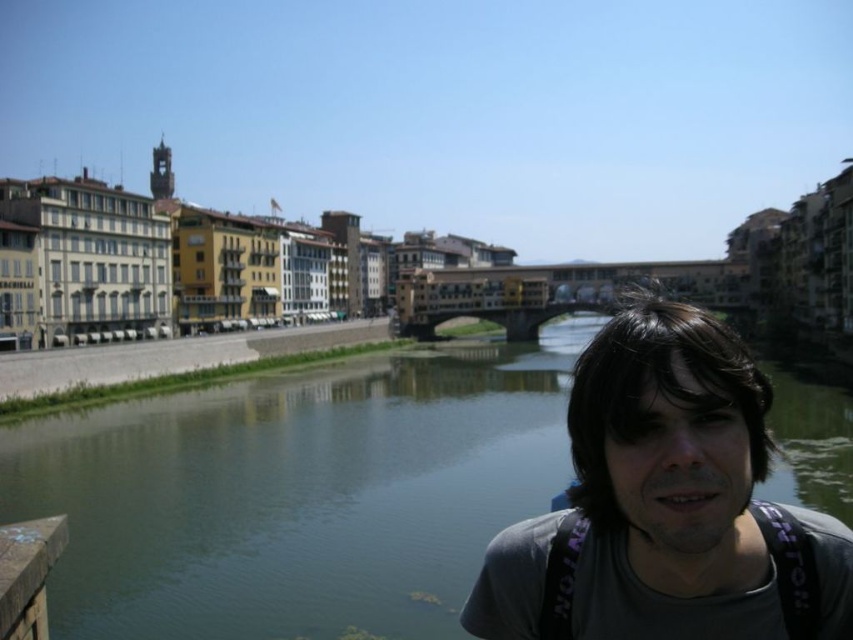
Question: Which point is farther to the camera?

Choices:
 (A) green water at center
 (B) gray fabric shirt at center
 (C) brown wooden rail at lower left

Answer: (A)

Question: Is green water at center thinner than brown wooden rail at lower left?

Choices:
 (A) yes
 (B) no

Answer: (B)

Question: Which object is positioned farthest from the green water at center?

Choices:
 (A) gray fabric shirt at center
 (B) brown wooden rail at lower left

Answer: (A)

Question: Which of the following is the closest to the observer?

Choices:
 (A) green water at center
 (B) brown wooden rail at lower left
 (C) gray fabric shirt at center

Answer: (C)

Question: Considering the relative positions of green water at center and brown wooden rail at lower left in the image provided, where is green water at center located with respect to brown wooden rail at lower left?

Choices:
 (A) left
 (B) right

Answer: (B)

Question: Does green water at center appear on the right side of gray fabric shirt at center?

Choices:
 (A) no
 (B) yes

Answer: (A)